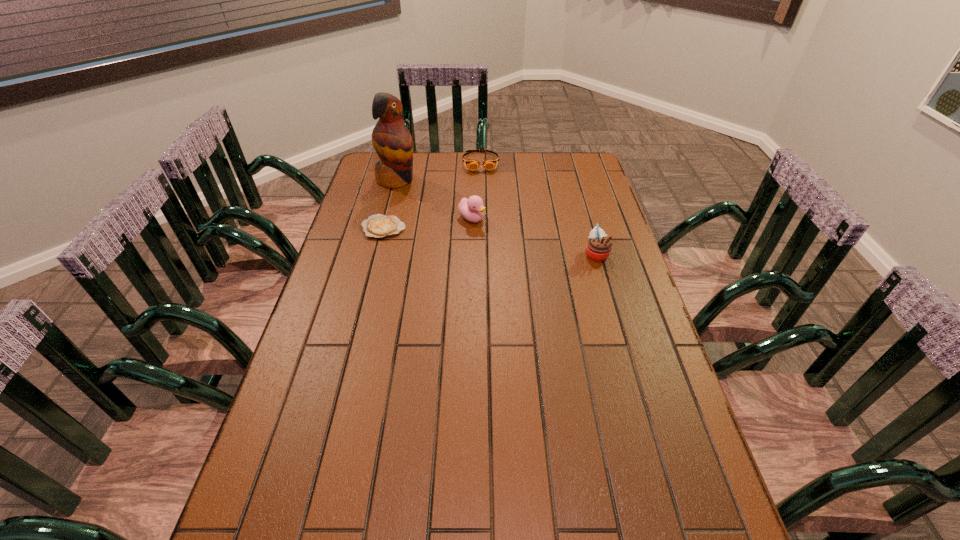
This screenshot has height=540, width=960. In order to click on vacant area in the image that satisfies the following two spatial constraints: 1. on the back side of the second shortest object; 2. on the right side of the duckling in this screenshot , I will do `click(472, 162)`.

Identify the location of blank space that satisfies the following two spatial constraints: 1. on the front side of the quiche; 2. on the front-facing side of the muffin. This screenshot has height=540, width=960. (377, 254).

This screenshot has width=960, height=540. Identify the location of vacant space that satisfies the following two spatial constraints: 1. on the front side of the third shortest object; 2. on the left side of the tallest object. (387, 219).